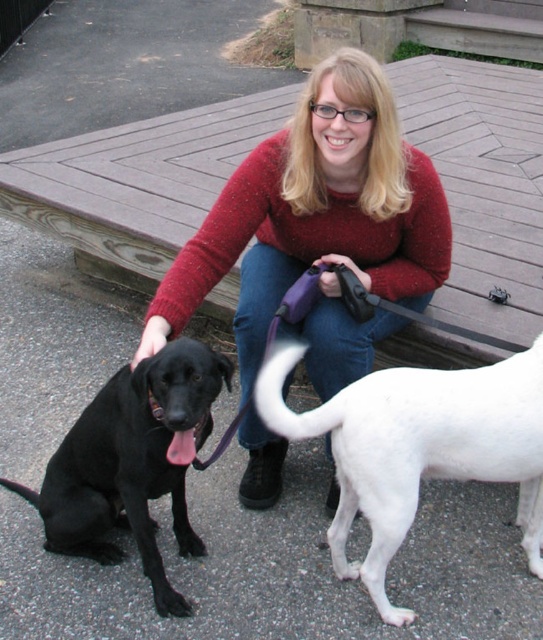
Question: Does white smooth dog at lower right appear on the right side of black smooth fur dog at left?

Choices:
 (A) yes
 (B) no

Answer: (A)

Question: Which point is farther to the camera?

Choices:
 (A) black smooth fur dog at left
 (B) white smooth dog at lower right

Answer: (B)

Question: Which object is farther from the camera taking this photo?

Choices:
 (A) red sweater at center
 (B) white smooth dog at lower right

Answer: (A)

Question: Which point is closer to the camera?

Choices:
 (A) (143, 408)
 (B) (353, 244)
 (C) (400, 404)

Answer: (C)

Question: Does red sweater at center have a smaller size compared to white smooth dog at lower right?

Choices:
 (A) no
 (B) yes

Answer: (A)

Question: Can you confirm if red sweater at center is wider than white smooth dog at lower right?

Choices:
 (A) yes
 (B) no

Answer: (A)